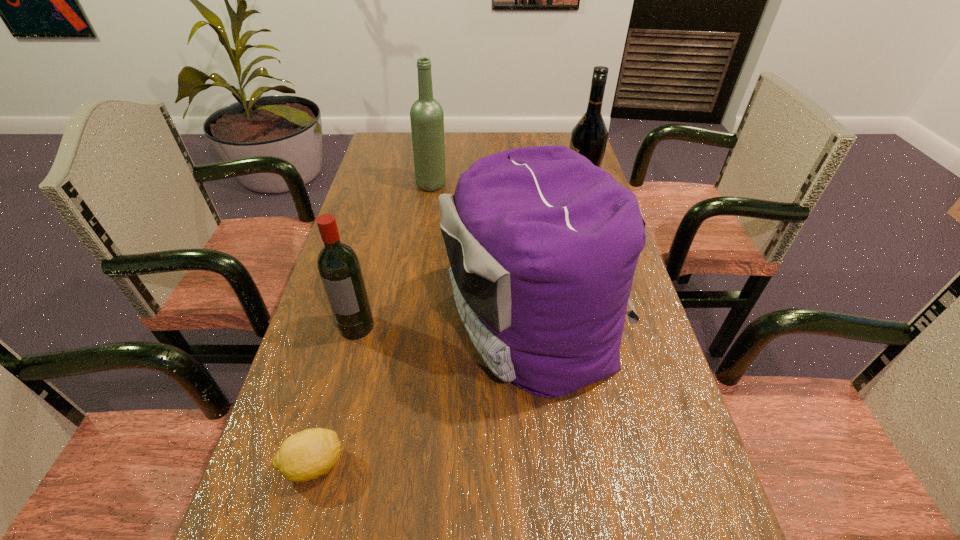
Locate an element on the screen. the third object from left to right is located at coordinates (426, 115).

What are the coordinates of `backpack` in the screenshot? It's located at (543, 245).

Find the location of a particular element. the rightmost wine bottle is located at coordinates (589, 137).

This screenshot has height=540, width=960. What are the coordinates of `the nearest wine bottle` in the screenshot? It's located at (339, 268).

Identify the location of the shortest wine bottle. The height and width of the screenshot is (540, 960). (339, 268).

Identify the location of lemon. (308, 454).

Identify the location of the nearest object. The image size is (960, 540). (308, 454).

This screenshot has width=960, height=540. I want to click on free spot located on the left of the second wine bottle from left to right, so click(385, 185).

This screenshot has width=960, height=540. I want to click on vacant space positioned on the front pocket of the backpack, so click(312, 322).

This screenshot has width=960, height=540. I want to click on free space located 0.080m on the front pocket of the backpack, so click(409, 322).